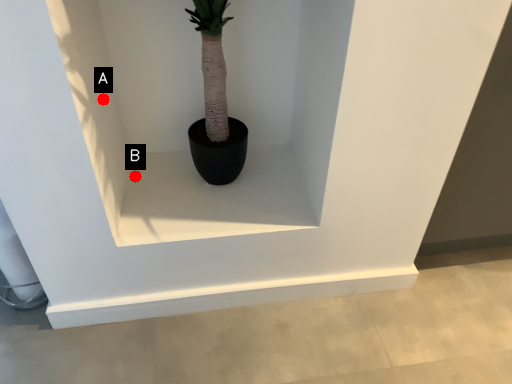
Question: Two points are circled on the image, labeled by A and B beside each circle. Which point is farther from the camera taking this photo?

Choices:
 (A) A is further
 (B) B is further

Answer: (B)